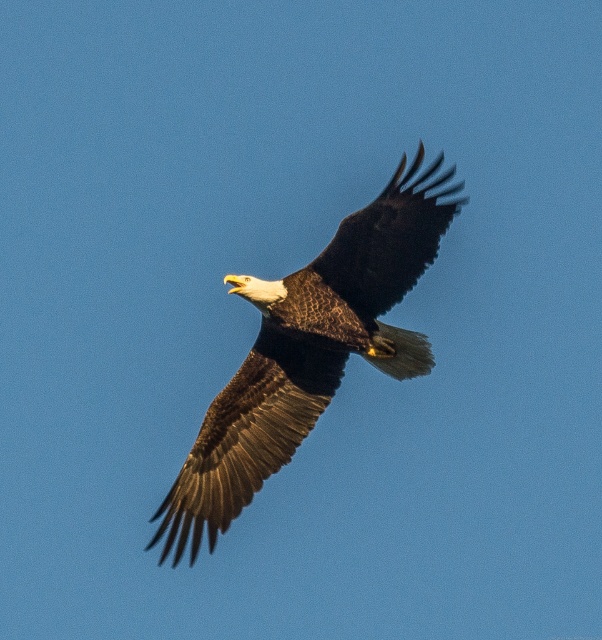
Image resolution: width=602 pixels, height=640 pixels. Describe the element at coordinates (309, 349) in the screenshot. I see `brown textured feathers at center` at that location.

Image resolution: width=602 pixels, height=640 pixels. Identify the location of brown textured feathers at center. (309, 349).